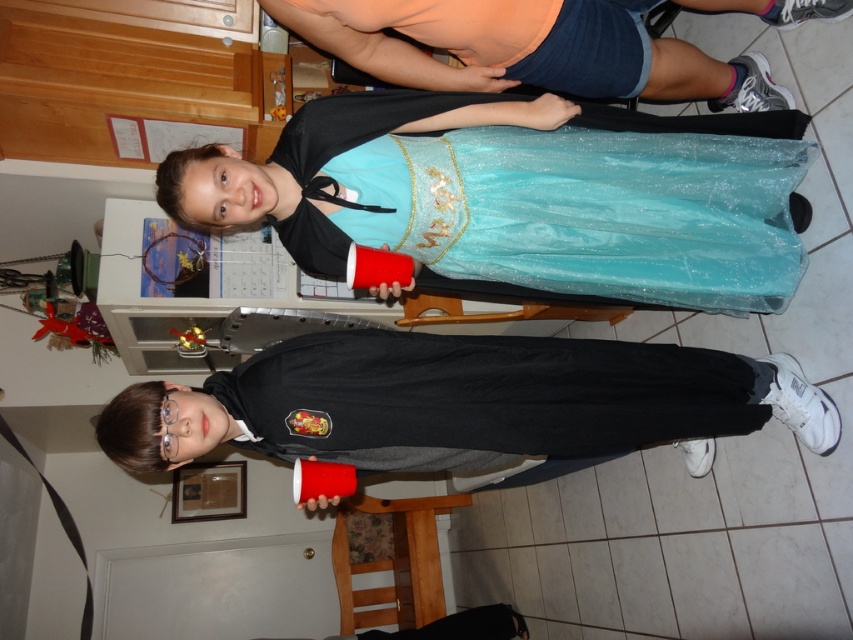
Question: Which point is closer to the camera taking this photo?

Choices:
 (A) (368, 116)
 (B) (524, 45)

Answer: (A)

Question: In this image, where is matte black hoodie at lower center located relative to shiny teal dress at center?

Choices:
 (A) left
 (B) right

Answer: (A)

Question: Which point is farther to the camera?

Choices:
 (A) (482, 97)
 (B) (381, 362)

Answer: (A)

Question: Which of the following is the closest to the observer?

Choices:
 (A) matte orange shorts at upper center
 (B) shiny teal dress at center
 (C) matte black hoodie at lower center

Answer: (C)

Question: Is matte black hoodie at lower center below matte orange shorts at upper center?

Choices:
 (A) no
 (B) yes

Answer: (B)

Question: Can you confirm if matte black hoodie at lower center is smaller than shiny teal dress at center?

Choices:
 (A) yes
 (B) no

Answer: (B)